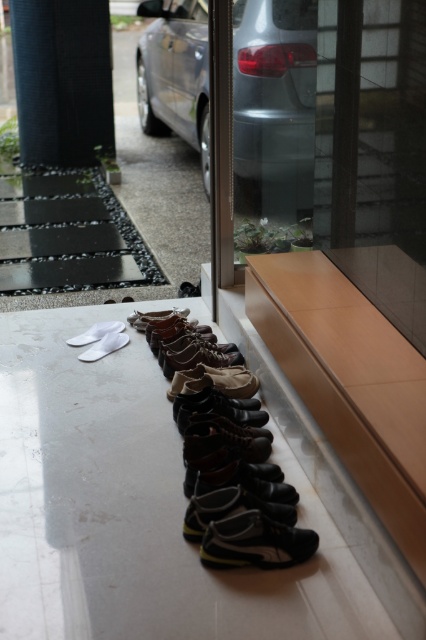
Question: Does leather shoes at center have a greater width compared to white fabric slipper at lower left?

Choices:
 (A) no
 (B) yes

Answer: (B)

Question: Does leather shoes at center have a larger size compared to white suede slipper at lower left?

Choices:
 (A) no
 (B) yes

Answer: (B)

Question: Is black suede shoe at center positioned behind white fabric slipper at lower left?

Choices:
 (A) yes
 (B) no

Answer: (B)

Question: Which of the following is the closest to the observer?

Choices:
 (A) (287, 541)
 (B) (288, 540)
 (C) (78, 336)
 (D) (23, 160)

Answer: (A)

Question: Among these points, which one is nearest to the camera?

Choices:
 (A) (210, 544)
 (B) (186, 513)

Answer: (A)

Question: Which point is farther to the camera?

Choices:
 (A) (216, 516)
 (B) (83, 353)
 (C) (270, 61)
 (D) (296, 499)

Answer: (C)